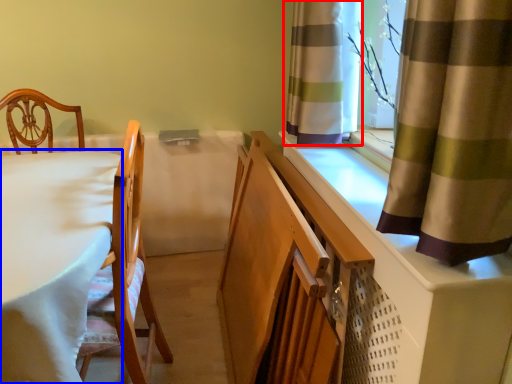
Question: Among these objects, which one is farthest to the camera, curtain (highlighted by a red box) or table (highlighted by a blue box)?

Choices:
 (A) curtain
 (B) table

Answer: (A)